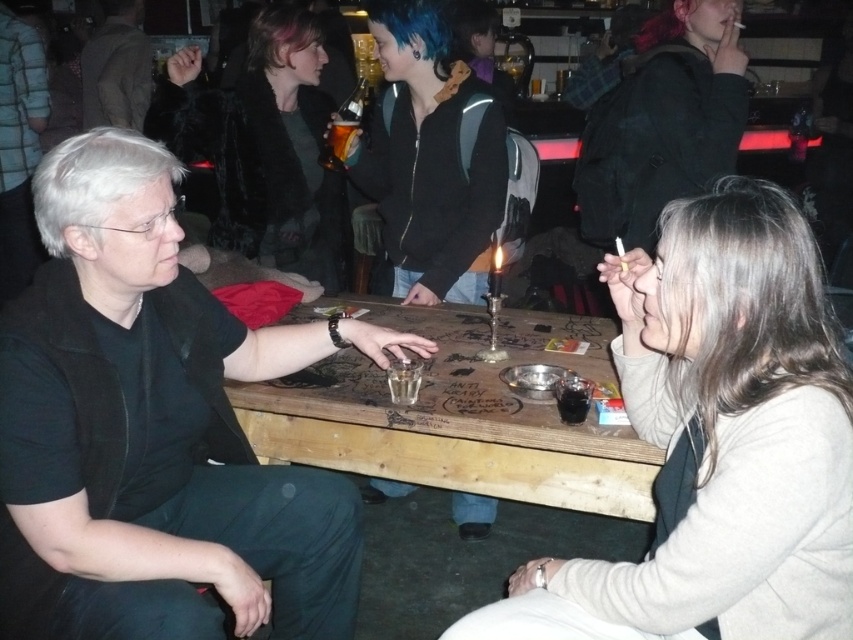
Does white matte hair at left have a greater width compared to blue matte hair at upper center?

Incorrect, white matte hair at left's width does not surpass blue matte hair at upper center's.

Find the location of a particular element. white matte hair at left is located at coordinates (x=94, y=180).

Identify the location of white matte hair at left. The height and width of the screenshot is (640, 853). (94, 180).

This screenshot has height=640, width=853. What do you see at coordinates (94, 180) in the screenshot?
I see `white matte hair at left` at bounding box center [94, 180].

Is point (57, 227) closer to viewer compared to point (567, 424)?

Yes, point (57, 227) is closer to viewer.

Find the location of a particular element. Image resolution: width=853 pixels, height=640 pixels. white matte hair at left is located at coordinates (94, 180).

Between wooden table at center and translucent amber liquid at center, which one is positioned lower?

wooden table at center

At what (x,y) coordinates should I click in order to perform the action: click on wooden table at center. Please return your answer as a coordinate pair (x, y). The height and width of the screenshot is (640, 853). Looking at the image, I should click on [x=459, y=417].